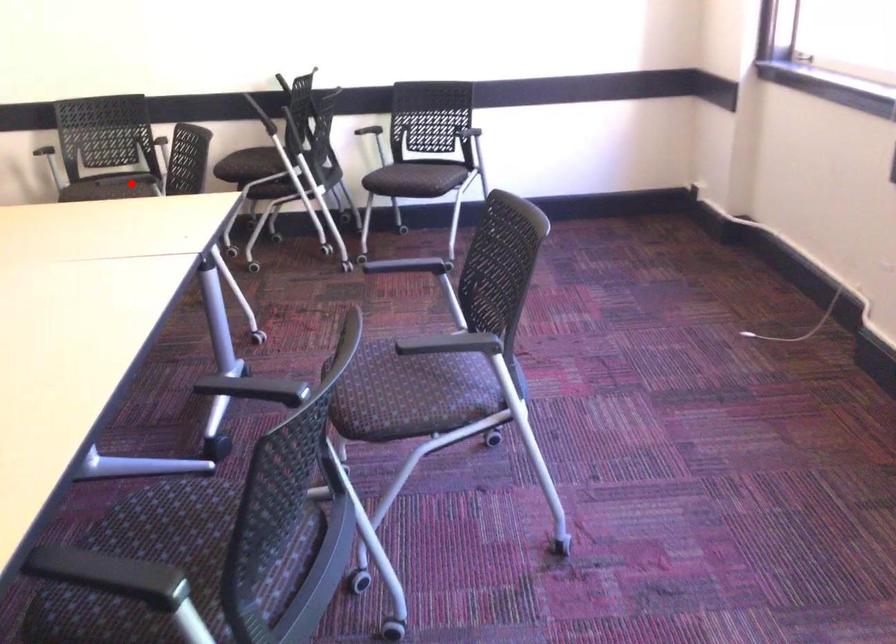
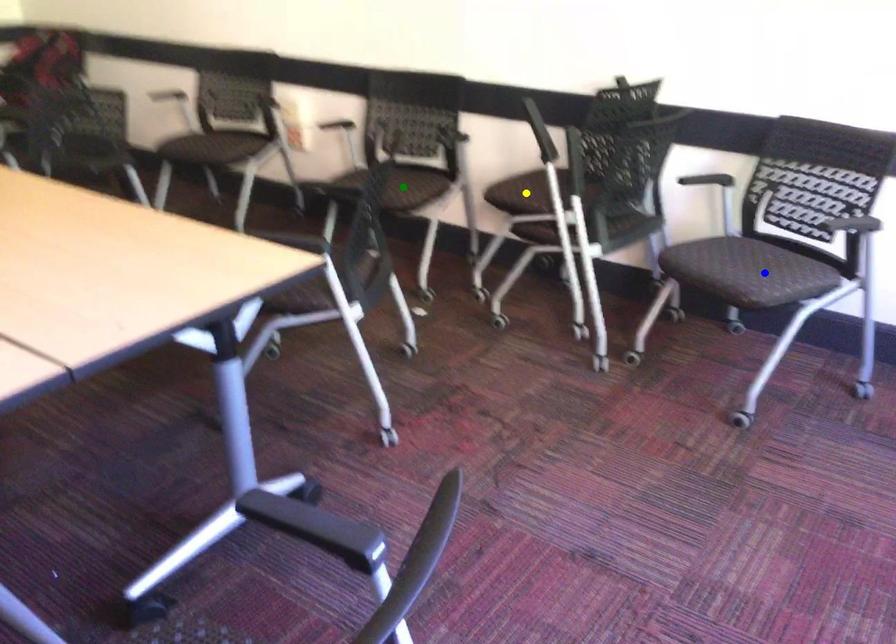
Question: I am providing you with two images of the same scene from different viewpoints. A red point is marked on the first image. You are given multiple points on the second image. Which mark in image 2 goes with the point in image 1?

Choices:
 (A) yellow point
 (B) green point
 (C) blue point

Answer: (B)